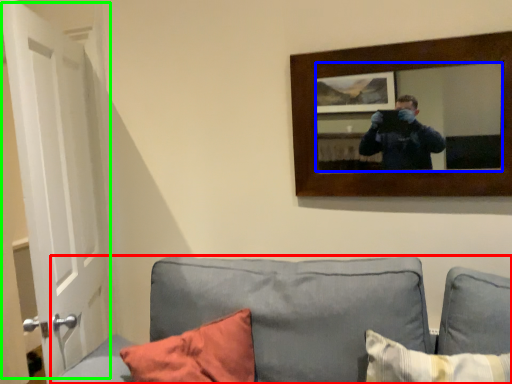
Question: Which object is positioned closest to studio couch (highlighted by a red box)? Select from mirror (highlighted by a blue box) and door (highlighted by a green box).

Choices:
 (A) mirror
 (B) door

Answer: (A)